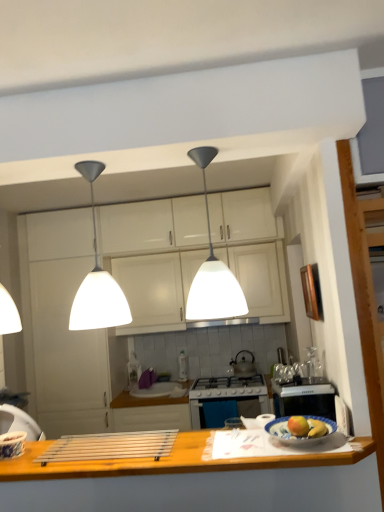
Find the location of a particular element. unoccupied area in front of yellow matte apple at center, the 1th apple in the left-to-right sequence is located at coordinates (307, 448).